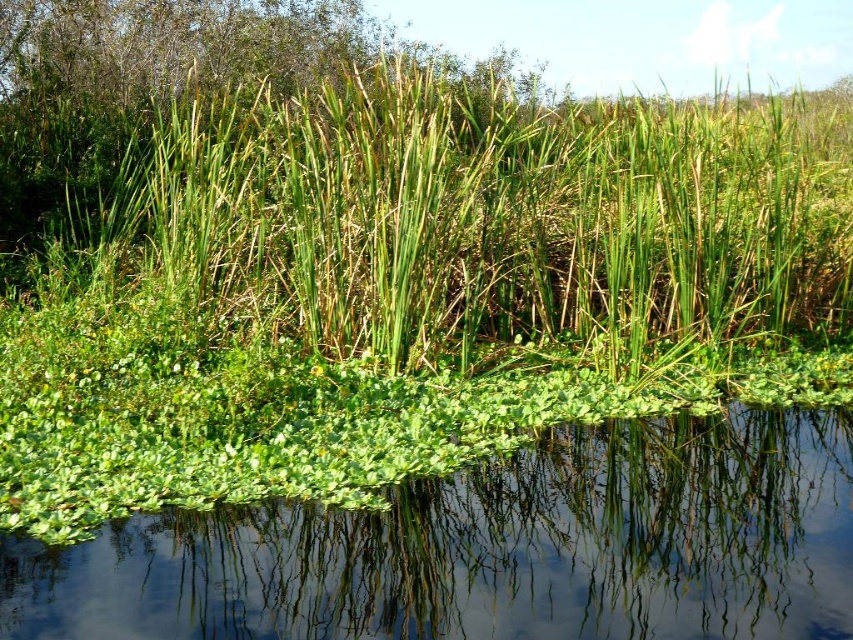
Question: Does green grass at center have a larger size compared to green leafy water at center?

Choices:
 (A) no
 (B) yes

Answer: (B)

Question: Is green grass at center behind green leafy water at center?

Choices:
 (A) no
 (B) yes

Answer: (B)

Question: Which object is closer to the camera taking this photo?

Choices:
 (A) green grass at center
 (B) green leafy water at center

Answer: (B)

Question: Does green grass at center have a lesser width compared to green leafy water at center?

Choices:
 (A) yes
 (B) no

Answer: (B)

Question: Which point is closer to the camera taking this photo?

Choices:
 (A) (405, 600)
 (B) (379, 182)

Answer: (A)